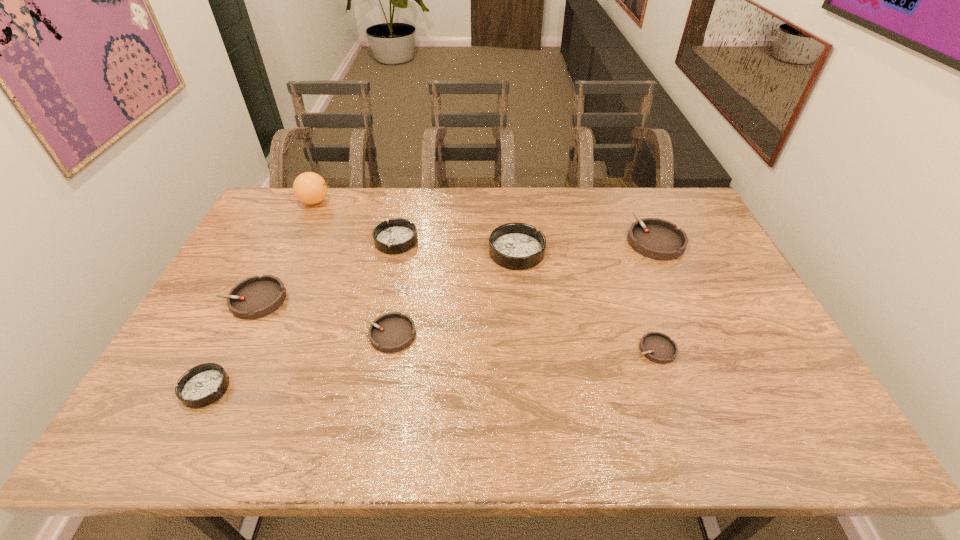
This screenshot has width=960, height=540. In order to click on the farthest object in this screenshot , I will do `click(310, 188)`.

Where is `the tallest object`? the tallest object is located at coordinates (310, 188).

The image size is (960, 540). What are the coordinates of `the farthest gray ashtray` in the screenshot? It's located at (654, 238).

This screenshot has width=960, height=540. In order to click on the rightmost dark ashtray in this screenshot , I will do `click(518, 246)`.

Locate an element on the screen. The image size is (960, 540). the third object from right to left is located at coordinates (518, 246).

At what (x,y) coordinates should I click in order to perform the action: click on the leftmost gray ashtray. Please return your answer as a coordinate pair (x, y). Image resolution: width=960 pixels, height=540 pixels. Looking at the image, I should click on (255, 297).

At what (x,y) coordinates should I click in order to perform the action: click on the second smallest dark ashtray. Please return your answer as a coordinate pair (x, y). This screenshot has width=960, height=540. Looking at the image, I should click on (398, 235).

Find the location of a particular element. The image size is (960, 540). the second smallest gray ashtray is located at coordinates (393, 332).

Where is `the nearest ashtray`? The image size is (960, 540). the nearest ashtray is located at coordinates (202, 385).

At what (x,y) coordinates should I click in order to perform the action: click on the leftmost dark ashtray. Please return your answer as a coordinate pair (x, y). Image resolution: width=960 pixels, height=540 pixels. Looking at the image, I should click on (202, 385).